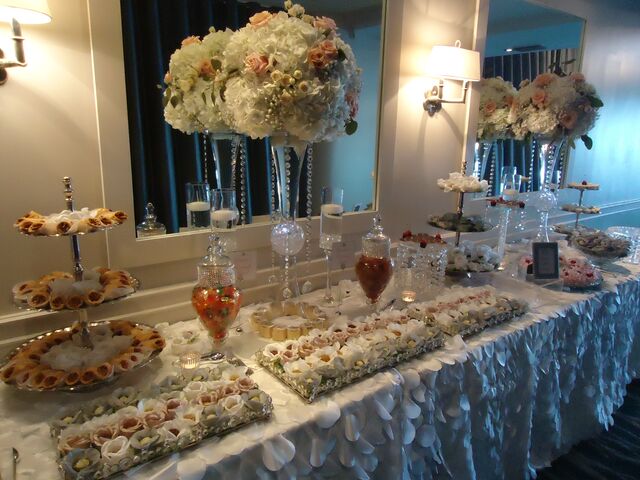
At what (x,y) coordinates should I click in order to perform the action: click on mirror. Please return your answer as a coordinate pair (x, y). The height and width of the screenshot is (480, 640). Looking at the image, I should click on (166, 172), (552, 36).